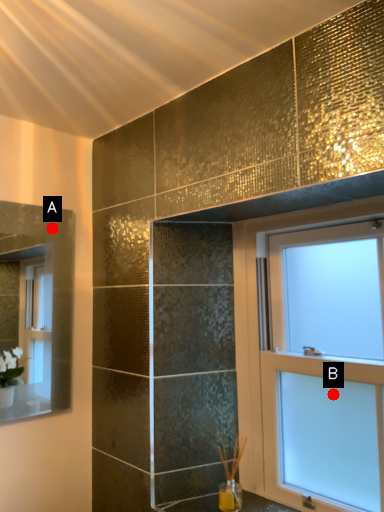
Question: Two points are circled on the image, labeled by A and B beside each circle. Among these points, which one is farthest from the camera?

Choices:
 (A) A is further
 (B) B is further

Answer: (A)